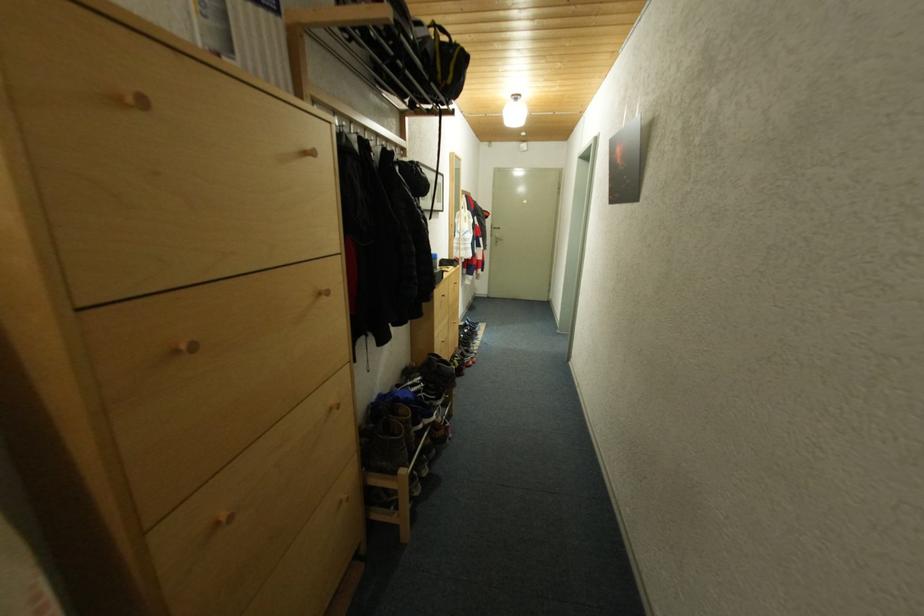
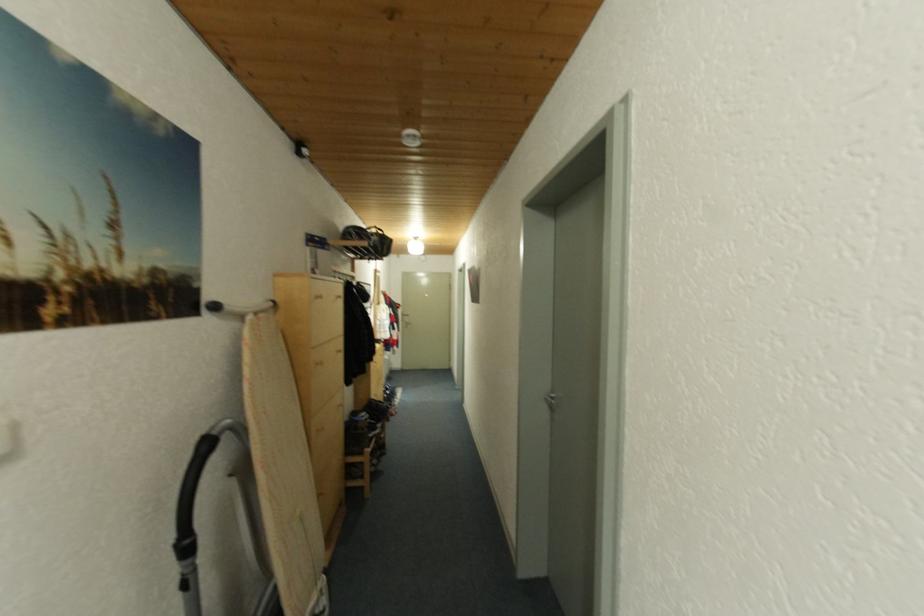
Question: The images are taken continuously from a first-person perspective. In which direction are you moving?

Choices:
 (A) Left
 (B) Right
 (C) Forward
 (D) Backward

Answer: (D)